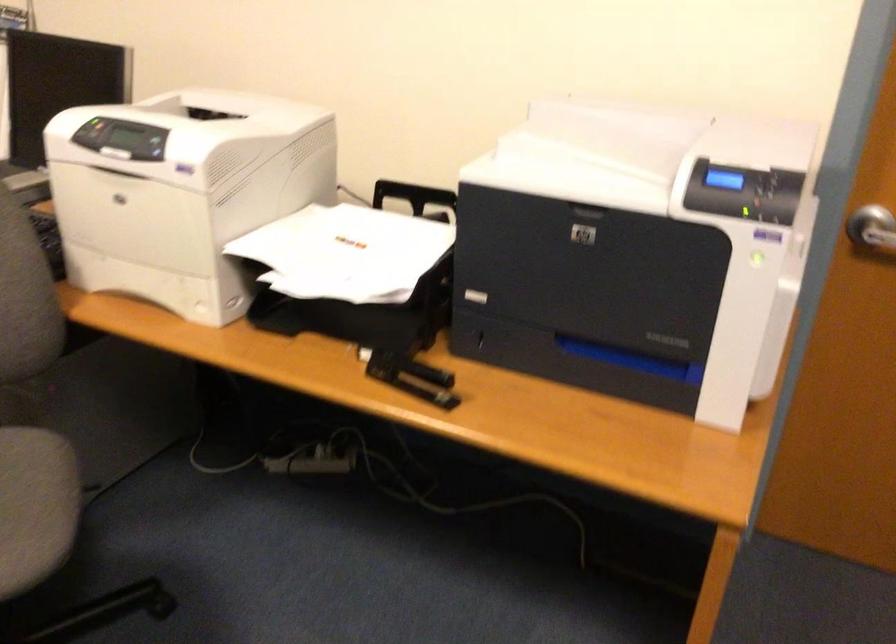
Describe the element at coordinates (35, 506) in the screenshot. I see `the chair sitting surface` at that location.